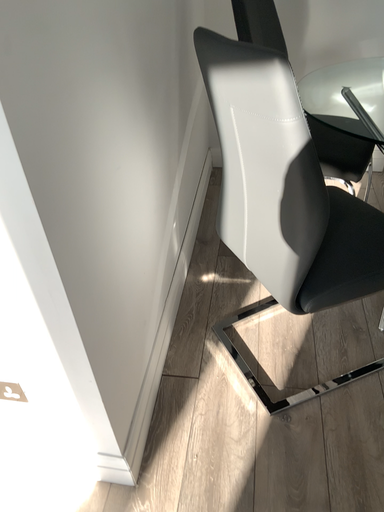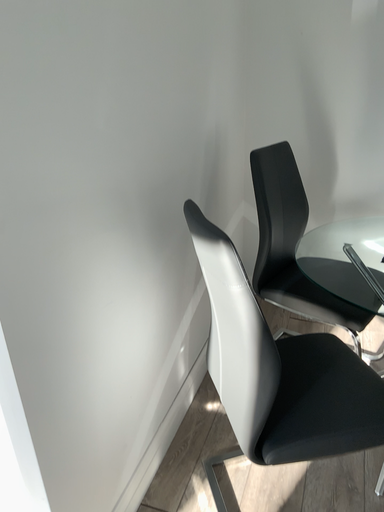
Question: How did the camera likely rotate when shooting the video?

Choices:
 (A) rotated downward
 (B) rotated upward

Answer: (B)